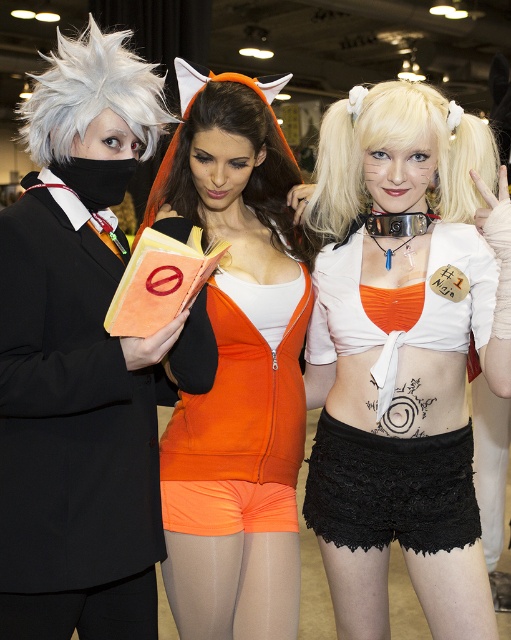
Does white matte/soft fabric top at center have a lesser width compared to white spiky wig at upper left?

No, white matte/soft fabric top at center is not thinner than white spiky wig at upper left.

In the scene shown: Does white matte/soft fabric top at center have a larger size compared to white spiky wig at upper left?

Indeed, white matte/soft fabric top at center has a larger size compared to white spiky wig at upper left.

Is point (467, 216) behind point (140, 80)?

Yes, point (467, 216) is farther from viewer.

Locate an element on the screen. The image size is (511, 640). white matte/soft fabric top at center is located at coordinates (400, 356).

Is point (204, 125) closer to camera compared to point (220, 490)?

That is True.

Is the position of orange fabric top at center more distant than that of neon orange tights at center?

No, it is in front of neon orange tights at center.

I want to click on orange fabric top at center, so click(237, 369).

Is white matte/soft fabric top at center taller than orange fabric wig at center?

Yes, white matte/soft fabric top at center is taller than orange fabric wig at center.

Between point (324, 216) and point (179, 205), which one is positioned behind?

Positioned behind is point (324, 216).

Find the location of `white matte/soft fabric top at center`. white matte/soft fabric top at center is located at coordinates coord(400,356).